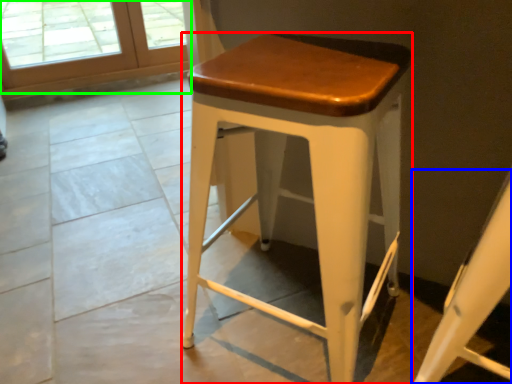
Question: Based on their relative distances, which object is nearer to stool (highlighted by a red box)? Choose from swivel chair (highlighted by a blue box) and screen door (highlighted by a green box).

Choices:
 (A) swivel chair
 (B) screen door

Answer: (A)